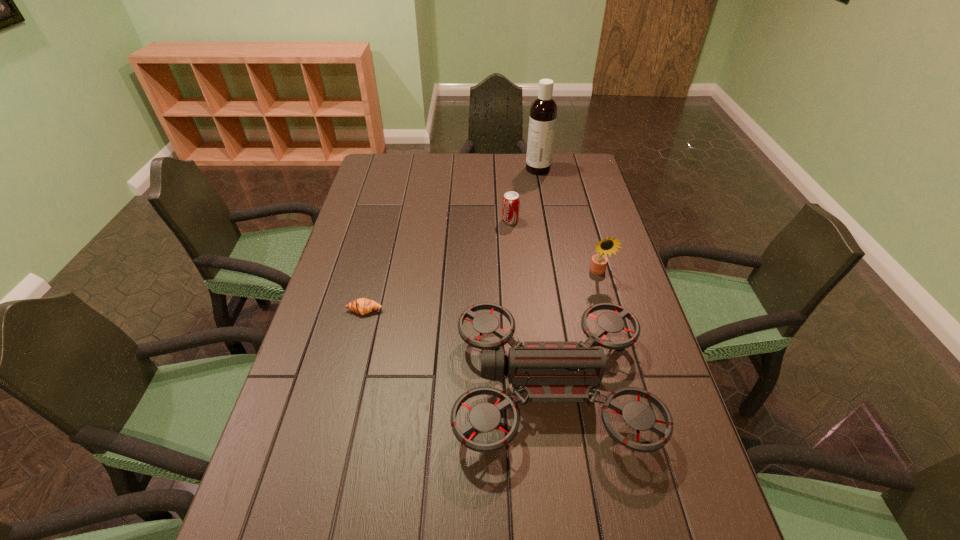
Locate an element on the screen. Image resolution: width=960 pixels, height=540 pixels. the farthest object is located at coordinates (543, 112).

This screenshot has height=540, width=960. I want to click on the tallest object, so click(543, 112).

Where is `sunflower`? This screenshot has width=960, height=540. sunflower is located at coordinates (598, 264).

Locate an element on the screen. Image resolution: width=960 pixels, height=540 pixels. the fourth shortest object is located at coordinates pyautogui.click(x=598, y=264).

At what (x,y) coordinates should I click in order to perform the action: click on the nearest object. Please return your answer as a coordinate pair (x, y). This screenshot has height=540, width=960. Looking at the image, I should click on (546, 371).

This screenshot has height=540, width=960. I want to click on drone, so click(x=546, y=371).

Locate an element on the screen. the fourth nearest object is located at coordinates (511, 201).

This screenshot has height=540, width=960. Identify the location of the second shortest object. (511, 201).

You are a GUI agent. You are given a task and a screenshot of the screen. Output one action in this format:
    pyautogui.click(x=<x>, y=<y>)
    Task: Click on the fourth farthest object
    This screenshot has width=960, height=540.
    Given the screenshot: What is the action you would take?
    point(362,306)

Where is `the leftmost object`? Image resolution: width=960 pixels, height=540 pixels. the leftmost object is located at coordinates (362, 306).